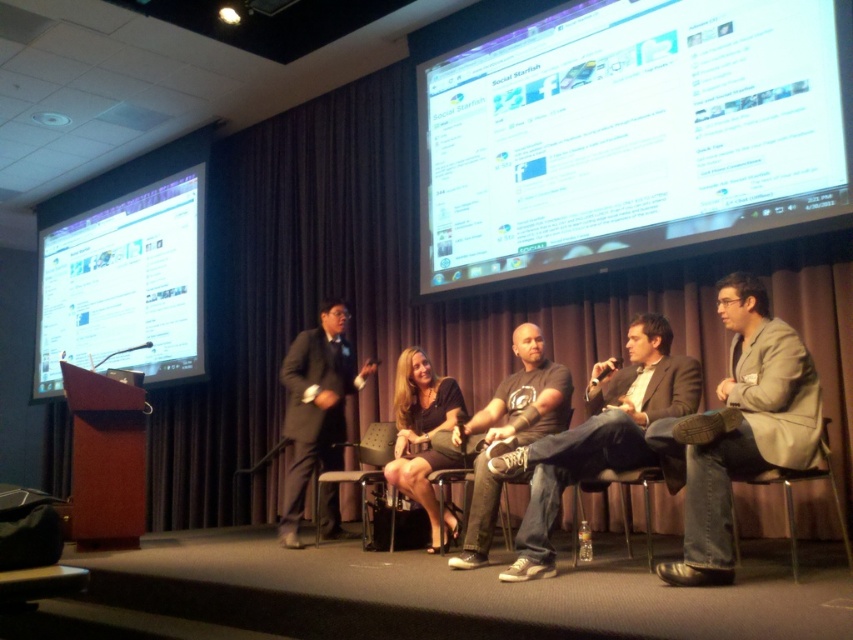
Looking at this image, you are an event organizer who needs to set up a projector for the panel discussion. The projector requires a surface that is both large enough and reflective enough to display a clear image. Based on the scene, which object between the white glossy screen at upper center and the metallic silver chair at lower right would be the best choice for projecting the image?

The white glossy screen at upper center is the best choice because it has a larger size and reflective surface compared to the metallic silver chair at lower right, making it suitable for projecting a clear image.

You are a stagehand who needs to position a 2.5 meter long extension cord from the white glossy screen at upper center to the matte gray chair at center. Will the cord be long enough to reach without needing to move either object?

The distance between the white glossy screen at upper center and the matte gray chair at center is 2.04 meters. The 2.5 meter extension cord is longer than the distance, so it will reach without needing to move either object.

You are sitting in the audience and looking at the stage. There are two points marked on the stage. The first point is at coordinates point [331,522] and the second point is at point [381,456]. Which of these two points is closer to you?

Point [331,522] is further to the camera than point [381,456], so the point closer to you is point [381,456].